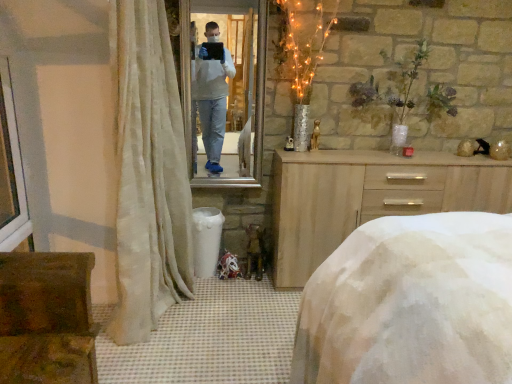
Question: In terms of width, does white plastic window frame at left look wider or thinner when compared to rustic wooden chest at lower left?

Choices:
 (A) wide
 (B) thin

Answer: (B)

Question: From the image's perspective, relative to rustic wooden chest at lower left, is white plastic window frame at left above or below?

Choices:
 (A) above
 (B) below

Answer: (A)

Question: Which object is positioned closest to the sheer beige curtain at left?

Choices:
 (A) white plastic window frame at left
 (B) metallic reflective mirror at center
 (C) rustic wooden chest at lower left
 (D) light wood dresser at center
 (E) white textured bed at center

Answer: (B)

Question: Which of these objects is positioned closest to the white plastic window frame at left?

Choices:
 (A) sheer beige curtain at left
 (B) light wood dresser at center
 (C) metallic reflective mirror at center
 (D) white plastic trash bin at lower center
 (E) rustic wooden chest at lower left

Answer: (A)